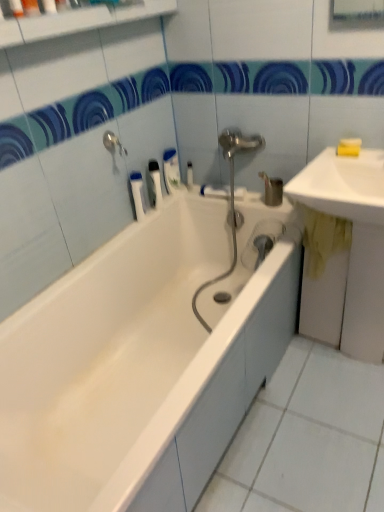
Question: Looking at their shapes, would you say white glossy bathtub at center is wider or thinner than white glossy sink at upper right, the 1th sink in the top-to-bottom sequence?

Choices:
 (A) wide
 (B) thin

Answer: (A)

Question: In the image, is white glossy bathtub at center on the left side or the right side of white glossy sink at upper right, arranged as the 2th sink when ordered from the bottom?

Choices:
 (A) right
 (B) left

Answer: (B)

Question: Which is farther from the white plastic bottle at upper center, marked as the 2th toiletry in a top-to-bottom arrangement?

Choices:
 (A) yellow matte soap at upper right, which is counted as the first soap, starting from the bottom
 (B) white glossy bathtub at center
 (C) white plastic tube at upper center, which appears as the 2th toiletry when viewed from the left
 (D) silver metallic tap at upper left
 (E) yellow matte bar of soap at upper right, which is the 1th soap in top-to-bottom order

Answer: (B)

Question: Estimate the real-world distances between objects in this image. Which object is closer to the matte orange soap at upper left, which is counted as the first toiletry, starting from the front?

Choices:
 (A) white glossy sink at upper right, the 1th sink in the top-to-bottom sequence
 (B) yellow matte bar of soap at upper right, which is counted as the 2th soap, starting from the bottom
 (C) white plastic tube at upper center, the 4th toiletry in the top-to-bottom sequence
 (D) yellow fabric at right, acting as the first sink starting from the bottom
 (E) white plastic bottle at upper center, the 4th toiletry when ordered from left to right

Answer: (C)